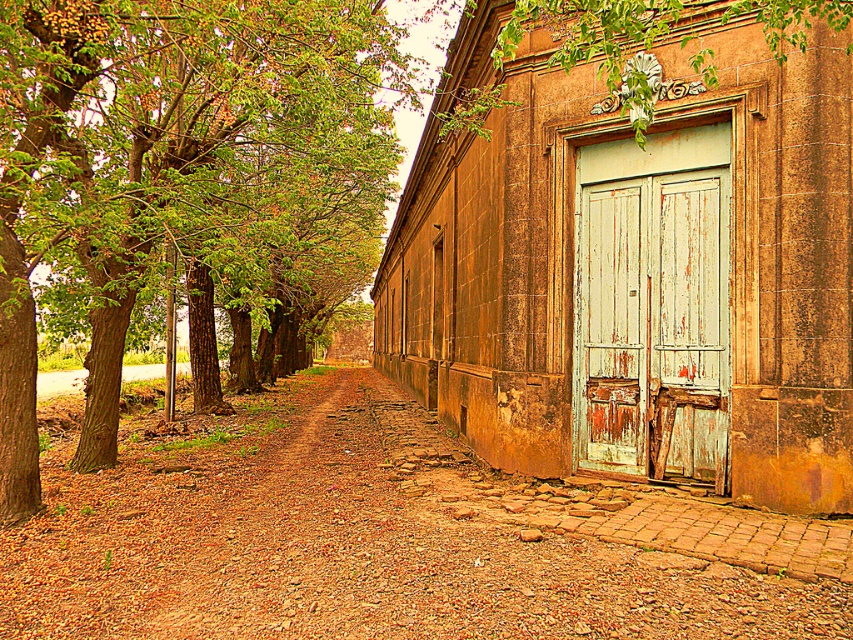
Question: Does green leafy tree at center appear under peeling white wood door at right?

Choices:
 (A) no
 (B) yes

Answer: (A)

Question: Is green leafy tree at center below peeling white wood door at right?

Choices:
 (A) no
 (B) yes

Answer: (A)

Question: Which object is closer to the camera taking this photo?

Choices:
 (A) brown gravel path at center
 (B) green leafy tree at center

Answer: (A)

Question: Is brown gravel path at center to the right of peeling white wood door at right from the viewer's perspective?

Choices:
 (A) yes
 (B) no

Answer: (B)

Question: Which point appears closest to the camera in this image?

Choices:
 (A) (672, 316)
 (B) (12, 436)

Answer: (B)

Question: Which point appears closest to the camera in this image?

Choices:
 (A) (671, 307)
 (B) (80, 556)
 (C) (320, 26)

Answer: (B)